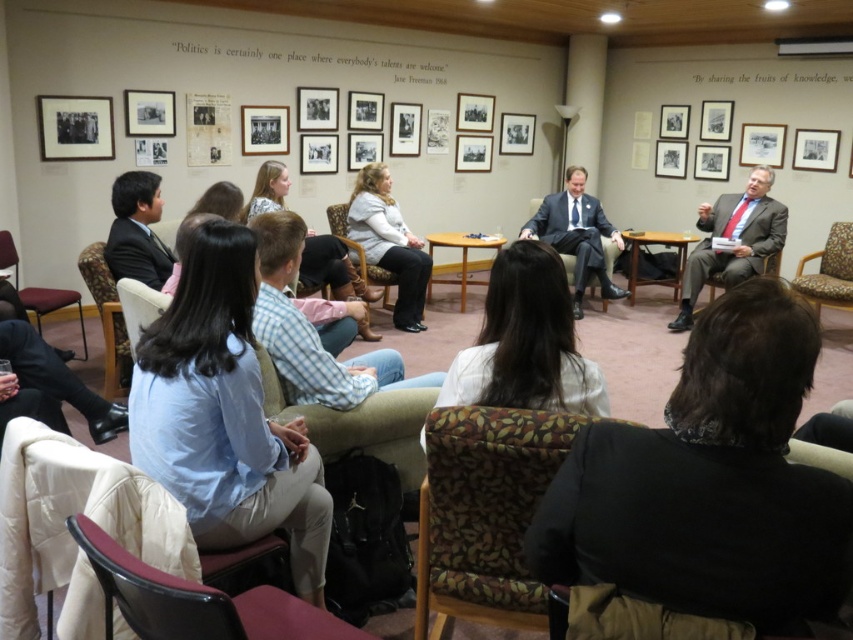
Question: In this image, where is patterned fabric chair at lower center located relative to blue plaid shirt at center?

Choices:
 (A) above
 (B) below

Answer: (B)

Question: Does matte gray suit at right have a greater width compared to maroon fabric armchair at left?

Choices:
 (A) no
 (B) yes

Answer: (B)

Question: In this image, where is patterned fabric chair at lower center located relative to camouflage-patterned fabric armchair at left?

Choices:
 (A) below
 (B) above

Answer: (A)

Question: Which of these objects is positioned closest to the matte black suit at center?

Choices:
 (A) matte gray suit at right
 (B) black fabric jacket at lower center
 (C) patterned fabric armchair at right
 (D) blue plaid shirt at center

Answer: (A)

Question: Which of the following is the farthest from the observer?

Choices:
 (A) (767, 212)
 (B) (97, 243)
 (C) (706, 545)

Answer: (A)

Question: Which of these objects is positioned farthest from the wooden round table at center?

Choices:
 (A) blue plaid shirt at center
 (B) dark brown leather armchair at right
 (C) light gray sweater at center
 (D) maroon fabric armchair at left

Answer: (D)